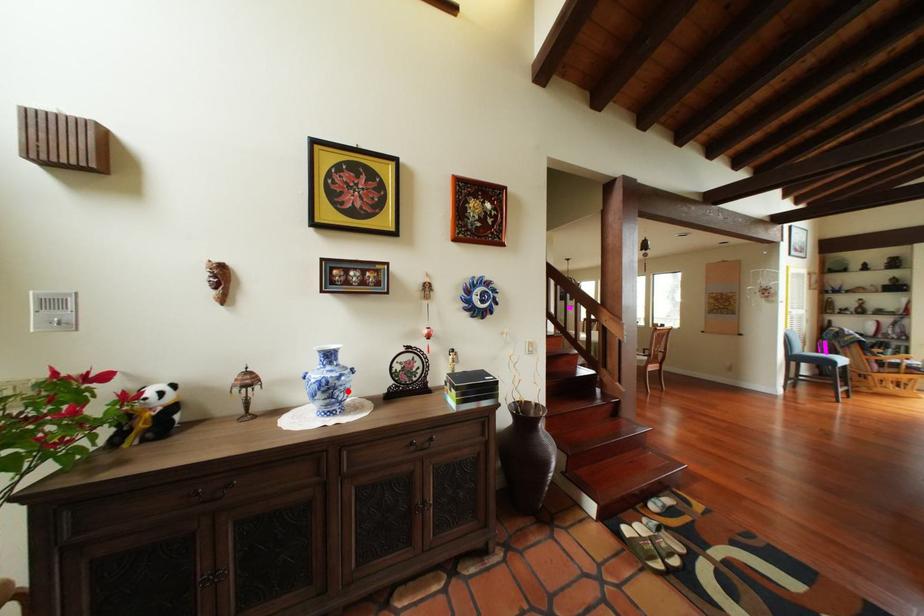
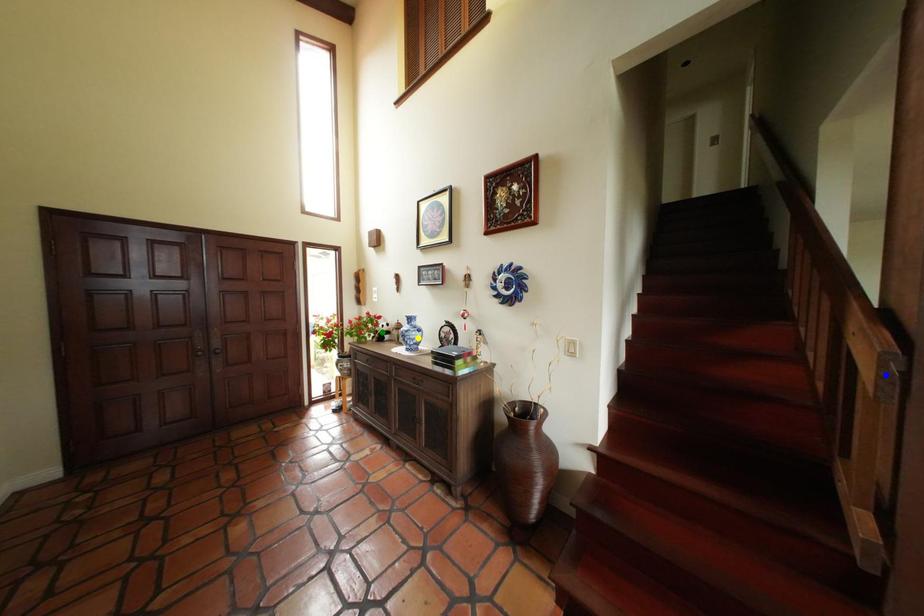
Question: I am providing you with two images of the same scene from different viewpoints. A red point is marked on the first image. You are given multiple points on the second image. Which point in image 2 represents the same 3d spot as the red point in image 1?

Choices:
 (A) yellow point
 (B) blue point
 (C) green point

Answer: (A)